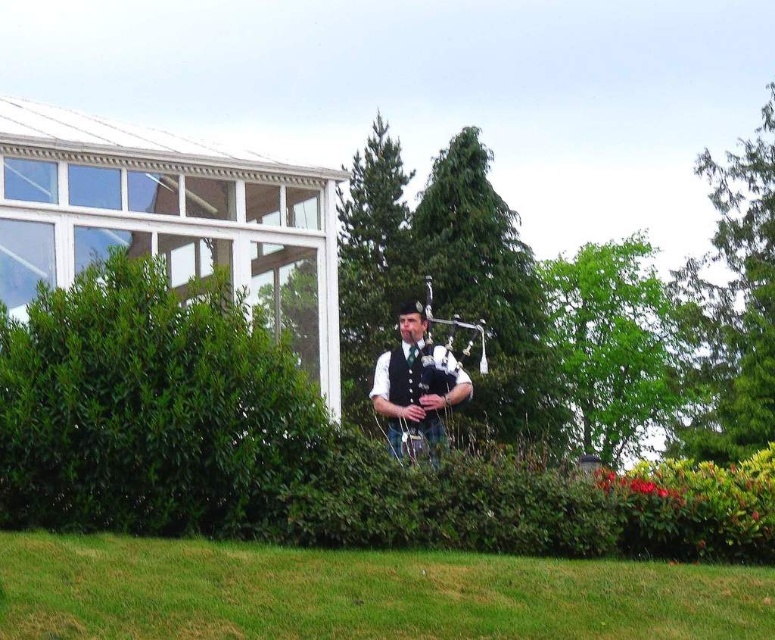
From the picture: Can you confirm if green leafy bush at center is positioned below green grass at lower center?

Actually, green leafy bush at center is above green grass at lower center.

Where is `green leafy bush at center`? This screenshot has height=640, width=775. green leafy bush at center is located at coordinates (150, 410).

Does green leafy bush at center have a larger size compared to matte black bagpipes at center?

Indeed, green leafy bush at center has a larger size compared to matte black bagpipes at center.

Between green leafy bush at center and matte black bagpipes at center, which one appears on the right side from the viewer's perspective?

matte black bagpipes at center

Is point (138, 333) positioned in front of point (412, 376)?

Yes.

At what (x,y) coordinates should I click in order to perform the action: click on green leafy bush at center. Please return your answer as a coordinate pair (x, y). The height and width of the screenshot is (640, 775). Looking at the image, I should click on (150, 410).

Which is below, green grass at lower center or matte black bagpipes at center?

green grass at lower center is lower down.

Is point (419, 636) farther from viewer compared to point (432, 452)?

No, (419, 636) is in front of (432, 452).

Image resolution: width=775 pixels, height=640 pixels. What do you see at coordinates (360, 593) in the screenshot?
I see `green grass at lower center` at bounding box center [360, 593].

Find the location of a particular element. The width and height of the screenshot is (775, 640). green grass at lower center is located at coordinates (360, 593).